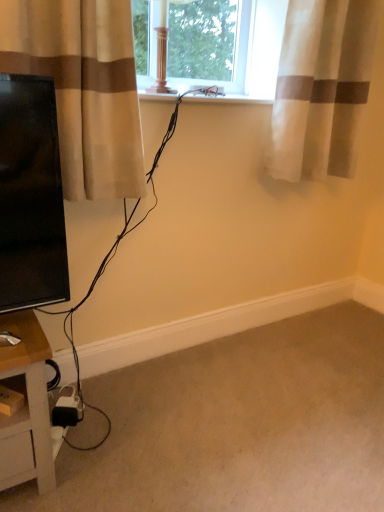
Question: Does beige carpet at lower right have a greater height compared to sheer fabric curtain at upper right, placed as the 2th curtain when sorted from left to right?

Choices:
 (A) yes
 (B) no

Answer: (B)

Question: Does beige carpet at lower right appear on the right side of sheer fabric curtain at upper right, positioned as the 1th curtain in right-to-left order?

Choices:
 (A) yes
 (B) no

Answer: (B)

Question: From the image's perspective, would you say beige carpet at lower right is positioned over sheer fabric curtain at upper right, the second curtain in the front-to-back sequence?

Choices:
 (A) yes
 (B) no

Answer: (B)

Question: From the image's perspective, is beige carpet at lower right under sheer fabric curtain at upper right, positioned as the 1th curtain in right-to-left order?

Choices:
 (A) no
 (B) yes

Answer: (B)

Question: Can you confirm if beige carpet at lower right is thinner than sheer fabric curtain at upper right, positioned as the 1th curtain in right-to-left order?

Choices:
 (A) no
 (B) yes

Answer: (A)

Question: Is beige carpet at lower right closer to the viewer compared to sheer fabric curtain at upper right, placed as the 2th curtain when sorted from left to right?

Choices:
 (A) no
 (B) yes

Answer: (B)

Question: Does sheer fabric curtain at upper right, the second curtain in the front-to-back sequence, have a greater width compared to beige fabric curtain at left, the second curtain when ordered from back to front?

Choices:
 (A) no
 (B) yes

Answer: (A)

Question: From the image's perspective, is sheer fabric curtain at upper right, the second curtain in the front-to-back sequence, below beige fabric curtain at left, the second curtain when ordered from back to front?

Choices:
 (A) yes
 (B) no

Answer: (B)

Question: Can you confirm if sheer fabric curtain at upper right, the second curtain in the front-to-back sequence, is positioned to the left of beige fabric curtain at left, the second curtain when ordered from back to front?

Choices:
 (A) yes
 (B) no

Answer: (B)

Question: Does sheer fabric curtain at upper right, placed as the 2th curtain when sorted from left to right, have a lesser width compared to beige fabric curtain at left, which is the first curtain in left-to-right order?

Choices:
 (A) yes
 (B) no

Answer: (A)

Question: Can you see sheer fabric curtain at upper right, the second curtain in the front-to-back sequence, touching beige fabric curtain at left, which is the 1th curtain from front to back?

Choices:
 (A) yes
 (B) no

Answer: (B)

Question: From a real-world perspective, is sheer fabric curtain at upper right, placed as the 2th curtain when sorted from left to right, positioned over beige fabric curtain at left, which is the 1th curtain from front to back, based on gravity?

Choices:
 (A) yes
 (B) no

Answer: (A)

Question: From the image's perspective, is beige fabric curtain at left, the second curtain when ordered from back to front, on sheer fabric curtain at upper right, arranged as the 1th curtain when viewed from the back?

Choices:
 (A) no
 (B) yes

Answer: (A)